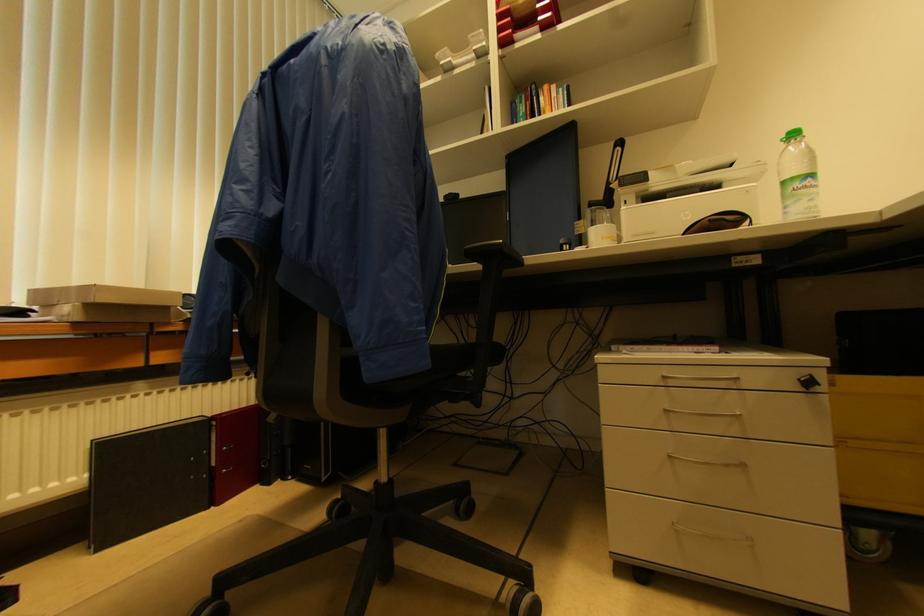
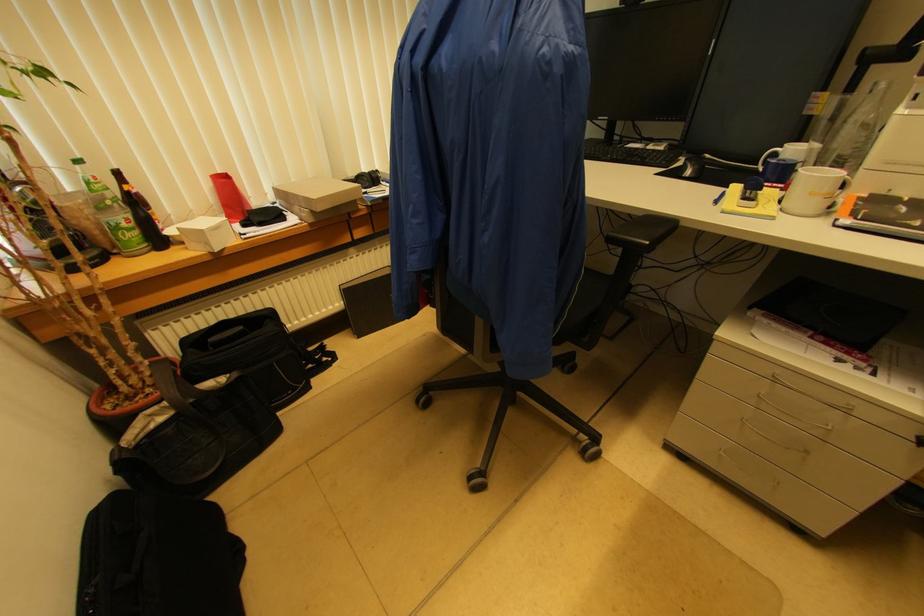
The first image is from the beginning of the video and the second image is from the end. How did the camera likely rotate when shooting the video?

The rotation direction of the camera is left-down.